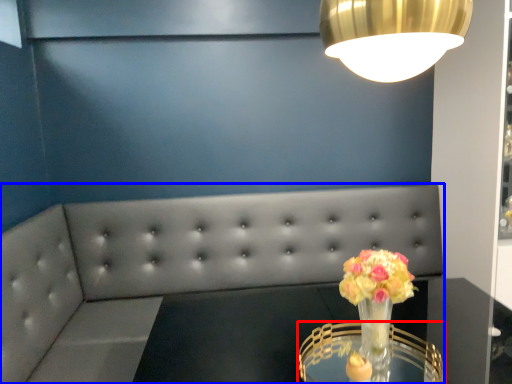
Question: Which object is further to the camera taking this photo, table (highlighted by a red box) or studio couch (highlighted by a blue box)?

Choices:
 (A) table
 (B) studio couch

Answer: (B)